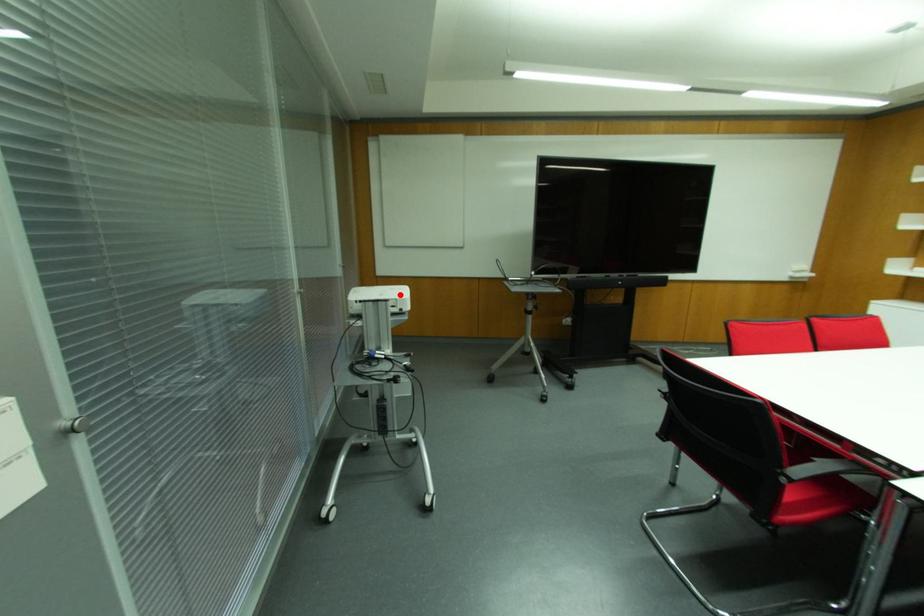
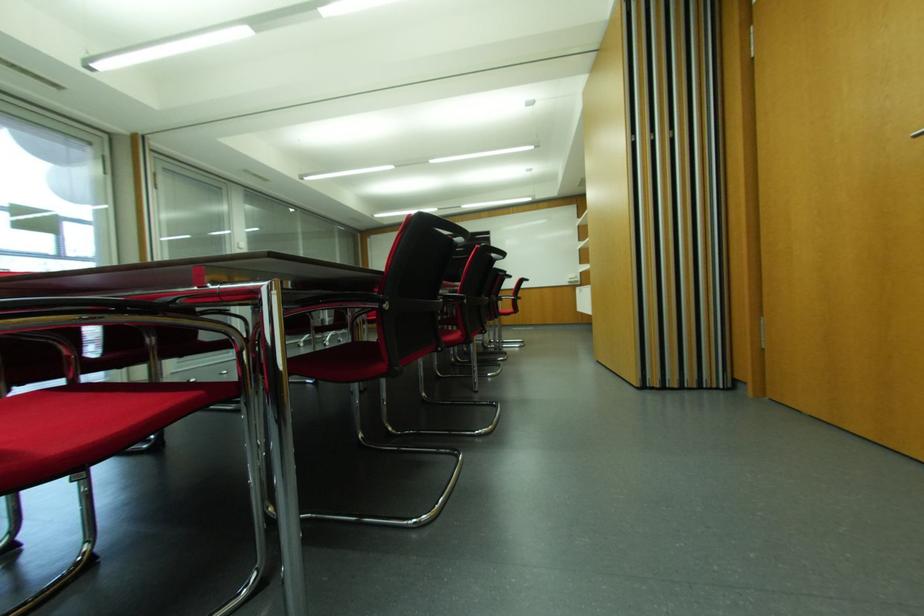
Question: I am providing you with two images of the same scene from different viewpoints. A red point is marked on the first image. At the location where the point appears in image 1, is it still visible in image 2?

Choices:
 (A) Yes
 (B) No

Answer: (B)